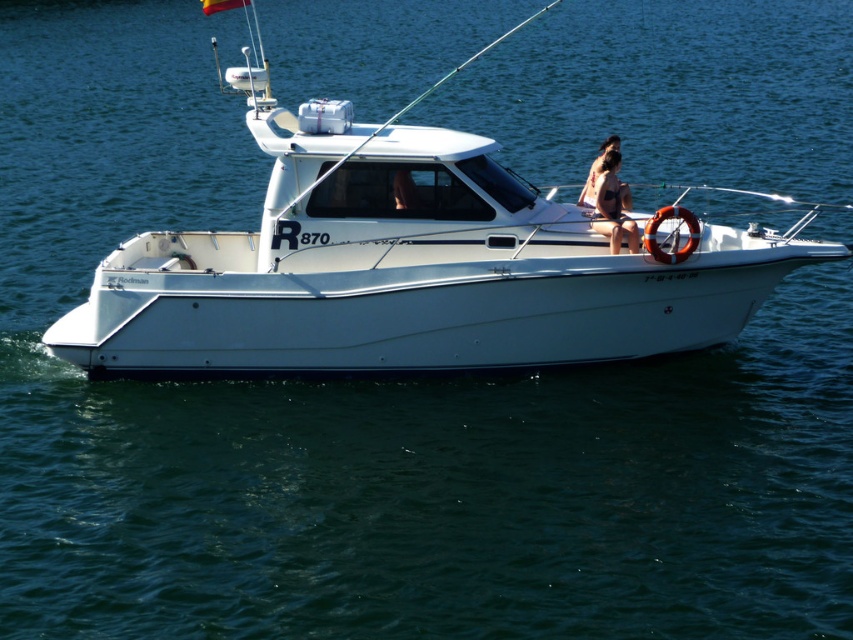
Question: Which of the following is the closest to the observer?

Choices:
 (A) tan skin person at center
 (B) tan skin bikini at center

Answer: (B)

Question: Can you confirm if white matte boat at center is positioned above tan skin person at center?

Choices:
 (A) no
 (B) yes

Answer: (B)

Question: Among these points, which one is nearest to the camera?

Choices:
 (A) (148, 356)
 (B) (608, 138)

Answer: (A)

Question: Is tan skin bikini at center thinner than tan skin person at center?

Choices:
 (A) yes
 (B) no

Answer: (A)

Question: Where is white matte boat at center located in relation to tan skin person at center in the image?

Choices:
 (A) right
 (B) left

Answer: (B)

Question: Estimate the real-world distances between objects in this image. Which object is farther from the white matte boat at center?

Choices:
 (A) tan skin person at center
 (B) tan skin bikini at center

Answer: (A)